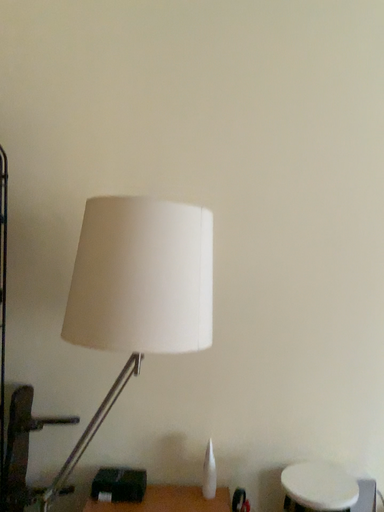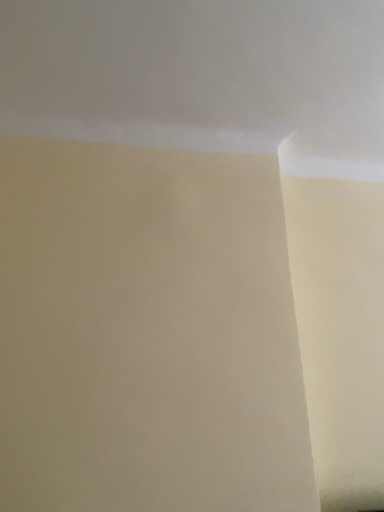
Question: How did the camera likely rotate when shooting the video?

Choices:
 (A) rotated downward
 (B) rotated upward

Answer: (B)